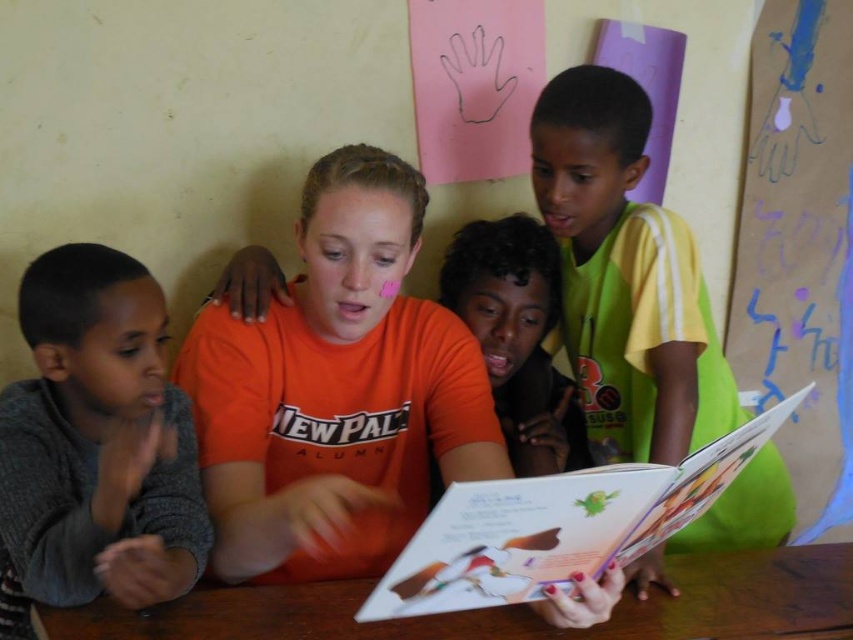
You are a photographer trying to capture a photo of the paperboard book at center without any obstruction. Considering the gray knitted sweater at left is taller than the book, will the sweater block the view of the book?

The gray knitted sweater at left is taller than the paperboard book at center, so it may block the view of the book depending on their positions. However, since the sweater is at the left and the book is at the center, positioning the camera appropriately could avoid obstruction.

You are an observer standing in front of the scene. Where is the yellow jersey at right located in the image?

The yellow jersey at right is located at the point with coordinates 0.434 on the x axis and 0.734 on the y axis.